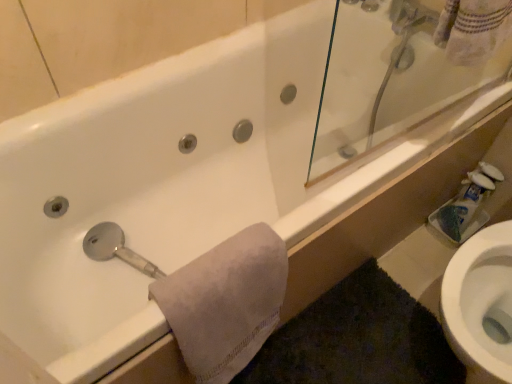
Question: Does point (476, 183) appear closer or farther from the camera than point (276, 289)?

Choices:
 (A) closer
 (B) farther

Answer: (B)

Question: Would you say white matte toilet paper at right is to the left or to the right of white soft towel at lower left in the picture?

Choices:
 (A) right
 (B) left

Answer: (A)

Question: Looking at the image, does white matte toilet paper at right seem bigger or smaller compared to white soft towel at lower left?

Choices:
 (A) small
 (B) big

Answer: (A)

Question: Considering their positions, is white soft towel at lower left located in front of or behind white matte toilet paper at right?

Choices:
 (A) behind
 (B) front

Answer: (B)

Question: From a real-world perspective, is white soft towel at lower left above or below white matte toilet paper at right?

Choices:
 (A) above
 (B) below

Answer: (A)

Question: Considering the positions of white soft towel at lower left and white matte toilet paper at right in the image, is white soft towel at lower left bigger or smaller than white matte toilet paper at right?

Choices:
 (A) small
 (B) big

Answer: (B)

Question: From the image's perspective, is white soft towel at lower left above or below white matte toilet paper at right?

Choices:
 (A) below
 (B) above

Answer: (A)